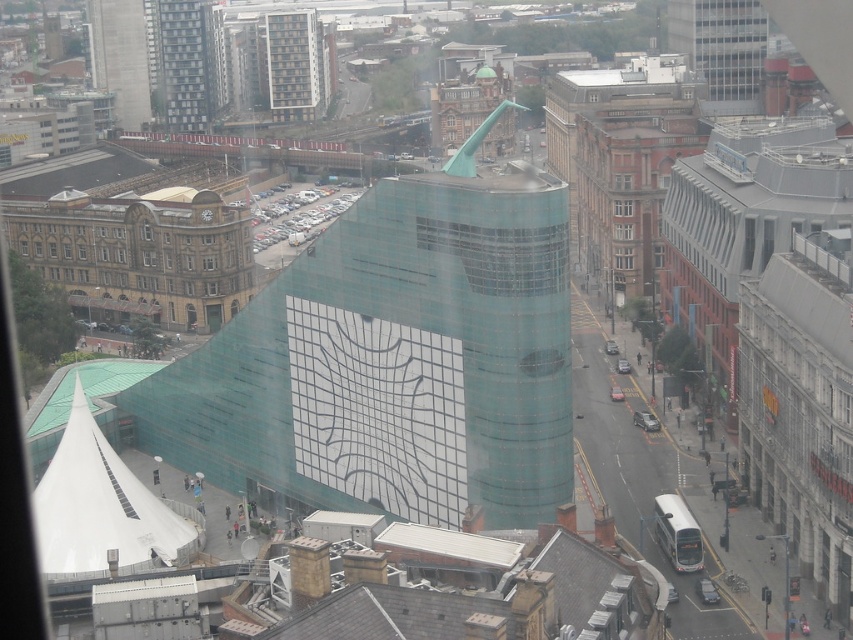
Does glassy teal building at upper left have a greater height compared to transparent glass window at upper center?

Correct, glassy teal building at upper left is much taller as transparent glass window at upper center.

Between point (202, 54) and point (270, 109), which one is positioned in front?

Positioned in front is point (202, 54).

Which is in front, point (175, 76) or point (271, 106)?

Point (175, 76)

The width and height of the screenshot is (853, 640). Find the location of `glassy teal building at upper left`. glassy teal building at upper left is located at coordinates (183, 65).